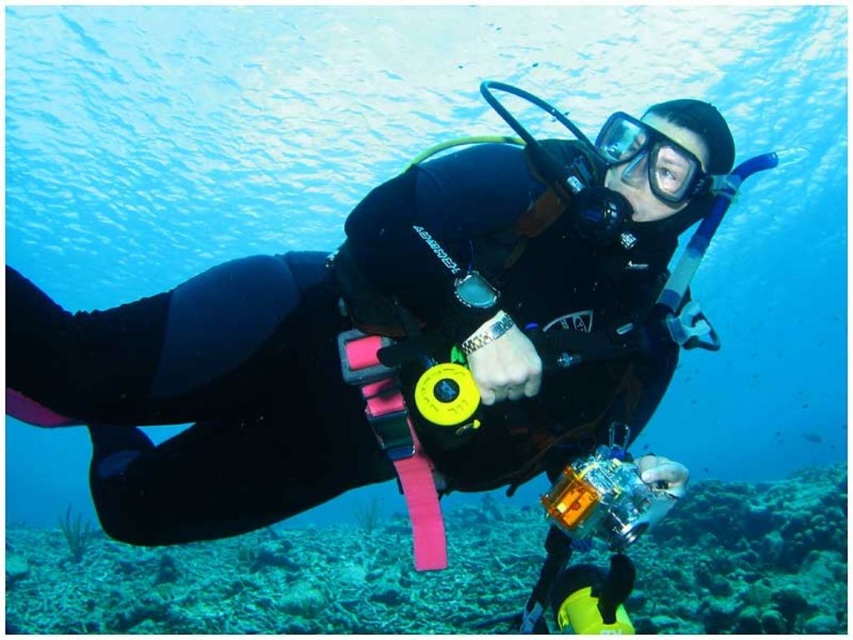
Question: Does transparent blue water at center appear on the left side of transparent rubber goggles at center?

Choices:
 (A) yes
 (B) no

Answer: (A)

Question: Which object is positioned closest to the transparent rubber goggles at center?

Choices:
 (A) rough coral reef at lower center
 (B) transparent blue water at center

Answer: (A)

Question: Which of the following is the closest to the observer?

Choices:
 (A) (386, 140)
 (B) (601, 156)
 (C) (415, 618)

Answer: (B)

Question: Can you confirm if transparent blue water at center is thinner than rough coral reef at lower center?

Choices:
 (A) yes
 (B) no

Answer: (B)

Question: Which object is farther from the camera taking this photo?

Choices:
 (A) transparent blue water at center
 (B) rough coral reef at lower center

Answer: (B)

Question: Can you confirm if transparent blue water at center is bigger than transparent rubber goggles at center?

Choices:
 (A) no
 (B) yes

Answer: (B)